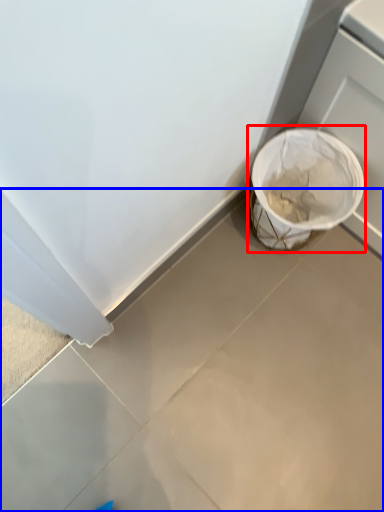
Question: Which object appears farthest to the camera in this image, waste container (highlighted by a red box) or concrete (highlighted by a blue box)?

Choices:
 (A) waste container
 (B) concrete

Answer: (A)